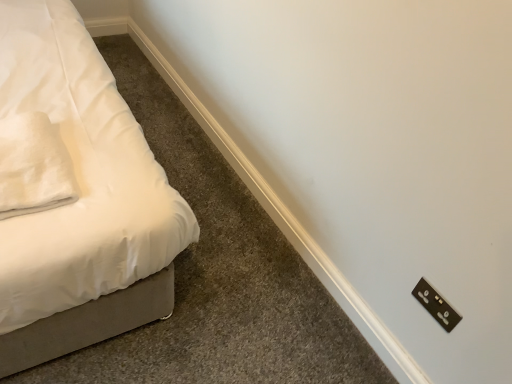
Question: Is white soft fabric pillow at left positioned beyond the bounds of black plastic light switch at lower right?

Choices:
 (A) no
 (B) yes

Answer: (B)

Question: Can you confirm if white soft fabric pillow at left is smaller than black plastic light switch at lower right?

Choices:
 (A) yes
 (B) no

Answer: (B)

Question: Is white soft fabric pillow at left thinner than black plastic light switch at lower right?

Choices:
 (A) no
 (B) yes

Answer: (A)

Question: Considering the relative sizes of white soft fabric pillow at left and black plastic light switch at lower right in the image provided, is white soft fabric pillow at left wider than black plastic light switch at lower right?

Choices:
 (A) no
 (B) yes

Answer: (B)

Question: Is white soft fabric pillow at left facing away from black plastic light switch at lower right?

Choices:
 (A) yes
 (B) no

Answer: (B)

Question: Is white soft fabric pillow at left surrounding black plastic light switch at lower right?

Choices:
 (A) yes
 (B) no

Answer: (B)

Question: Is black plastic light switch at lower right wider than white soft fabric pillow at left?

Choices:
 (A) no
 (B) yes

Answer: (A)

Question: Is white soft fabric pillow at left surrounded by black plastic light switch at lower right?

Choices:
 (A) no
 (B) yes

Answer: (A)

Question: From the image's perspective, is black plastic light switch at lower right under white soft fabric pillow at left?

Choices:
 (A) yes
 (B) no

Answer: (A)

Question: Considering the relative sizes of black plastic light switch at lower right and white soft fabric pillow at left in the image provided, is black plastic light switch at lower right thinner than white soft fabric pillow at left?

Choices:
 (A) yes
 (B) no

Answer: (A)

Question: Is black plastic light switch at lower right aimed at white soft fabric pillow at left?

Choices:
 (A) no
 (B) yes

Answer: (A)

Question: From a real-world perspective, does black plastic light switch at lower right sit lower than white soft fabric pillow at left?

Choices:
 (A) yes
 (B) no

Answer: (A)

Question: From a real-world perspective, is white soft fabric pillow at left above or below black plastic light switch at lower right?

Choices:
 (A) above
 (B) below

Answer: (A)